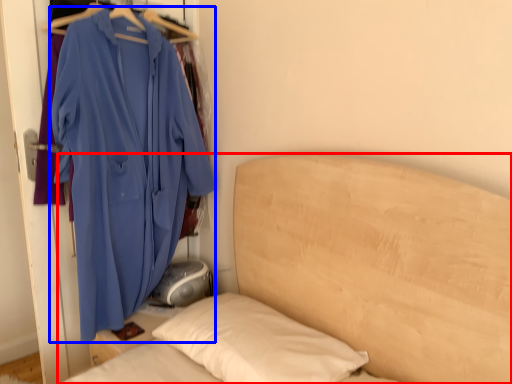
Question: Which object is further to the camera taking this photo, bed (highlighted by a red box) or jacket (highlighted by a blue box)?

Choices:
 (A) bed
 (B) jacket

Answer: (B)